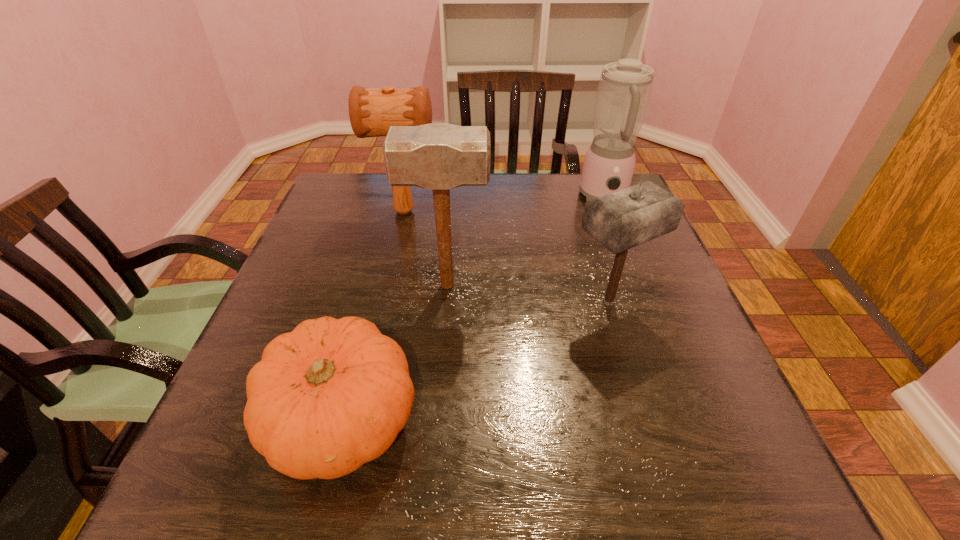
You are a GUI agent. You are given a task and a screenshot of the screen. Output one action in this format:
    pyautogui.click(x=<x>, y=<y>)
    Task: Click on the vacant space at the near edge of the desktop
    
    Given the screenshot: What is the action you would take?
    pyautogui.click(x=445, y=509)

Where is `vacant area at the right edge of the desktop`? The height and width of the screenshot is (540, 960). vacant area at the right edge of the desktop is located at coordinates (695, 317).

The image size is (960, 540). Find the location of `free spot at the far left corner of the desktop`. free spot at the far left corner of the desktop is located at coordinates (346, 205).

Identify the location of vacant area that lies between the farthest mallet and the pumpkin. This screenshot has width=960, height=540. (373, 316).

Locate an element on the screen. Image resolution: width=960 pixels, height=540 pixels. free space between the rightmost mallet and the food processor is located at coordinates (607, 249).

Locate an element on the screen. The height and width of the screenshot is (540, 960). free area in between the farthest mallet and the rightmost mallet is located at coordinates (507, 257).

Where is `vacant area between the rightmost mallet and the nearest object`? vacant area between the rightmost mallet and the nearest object is located at coordinates coord(476,361).

This screenshot has width=960, height=540. I want to click on vacant space that is in between the food processor and the pumpkin, so click(x=473, y=308).

At what (x,y) coordinates should I click in order to perform the action: click on empty space between the food processor and the farthest mallet. Please return your answer as a coordinate pair (x, y). The height and width of the screenshot is (540, 960). Looking at the image, I should click on (504, 205).

Where is `free area in between the rightmost mallet and the pumpkin`? The image size is (960, 540). free area in between the rightmost mallet and the pumpkin is located at coordinates (476, 361).